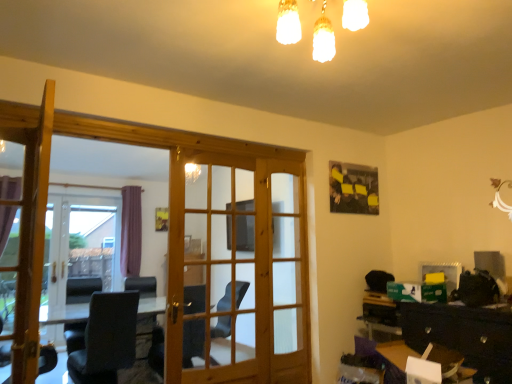
Question: Is wooden door at center, which ranks as the 1th door in right-to-left order, to the left or to the right of matte wooden screen door at center, which is the first screen door from front to back, in the image?

Choices:
 (A) right
 (B) left

Answer: (B)

Question: From a real-world perspective, is wooden door at center, which is counted as the 1th door, starting from the back, physically located above or below matte wooden screen door at center, positioned as the second screen door in back-to-front order?

Choices:
 (A) above
 (B) below

Answer: (B)

Question: Estimate the real-world distances between objects in this image. Which object is closer to the wooden table at lower right?

Choices:
 (A) wooden door at left, placed as the 1th door when sorted from front to back
 (B) clear glass door at left, the second screen door positioned from the right
 (C) black glossy dresser at lower right
 (D) matte wooden screen door at center, which is the first screen door from front to back
 (E) wooden door at center, which is counted as the 1th door, starting from the back

Answer: (C)

Question: Which object is positioned closest to the matte glass chandelier at upper center?

Choices:
 (A) clear glass door at left, arranged as the 1th screen door when viewed from the left
 (B) black glossy dresser at lower right
 (C) wooden door at left, the first door from the left
 (D) wooden table at lower right
 (E) wooden door at center, which ranks as the 1th door in right-to-left order

Answer: (C)